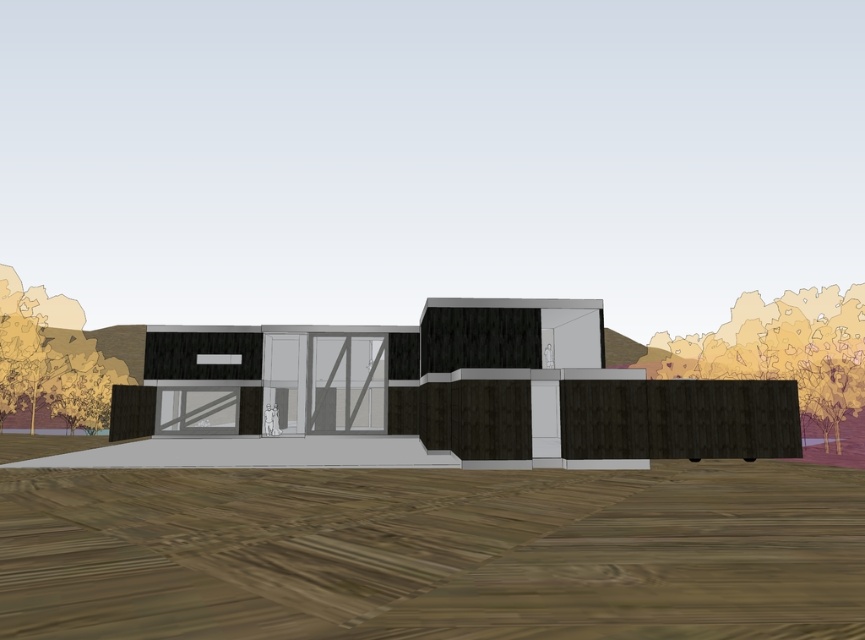
You are standing at the entrance of the building and looking towards the paved area. There are two points marked on the ground in front of you. The first point is at coordinates point (830, 291), and the second point is at coordinates point (99, 426). Which of these points is closer to you?

Point (830, 291) is closer to the camera than point (99, 426), so the first point is closer to you.